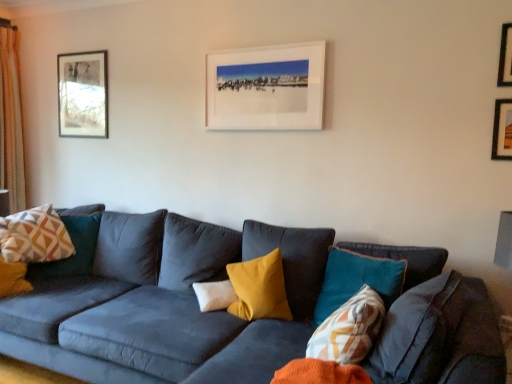
Describe the element at coordinates (502, 130) in the screenshot. This screenshot has width=512, height=384. I see `wooden picture frame at upper right, which is the third picture frame from back to front` at that location.

What do you see at coordinates (34, 236) in the screenshot? I see `geometric-patterned fabric pillow at left, the 3th pillow from the right` at bounding box center [34, 236].

Where is `wooden framed picture at upper left, which appears as the fourth picture frame when viewed from the front`? Image resolution: width=512 pixels, height=384 pixels. wooden framed picture at upper left, which appears as the fourth picture frame when viewed from the front is located at coordinates (83, 94).

Measure the distance between point (216,129) and camera.

They are 2.79 meters apart.

The height and width of the screenshot is (384, 512). In order to click on wooden picture frame at upper right, which ranks as the second picture frame in right-to-left order in this screenshot , I will do `click(502, 130)`.

Considering their positions, is metallic gold picture frame at upper right, which appears as the first picture frame when viewed from the right, located in front of or behind geometric-patterned fabric pillow at left, the third pillow from the front?

Visually, metallic gold picture frame at upper right, which appears as the first picture frame when viewed from the right, is located in front of geometric-patterned fabric pillow at left, the third pillow from the front.

From a real-world perspective, which object stands above the other?

From a 3D spatial view, metallic gold picture frame at upper right, the fourth picture frame when ordered from left to right, is above.

Who is taller, metallic gold picture frame at upper right, the fourth picture frame when ordered from left to right, or geometric-patterned fabric pillow at left, the 3th pillow from the right?

geometric-patterned fabric pillow at left, the 3th pillow from the right, is taller.

Which pillow is the 2nd one when counting from the back of the metallic gold picture frame at upper right, the first picture frame viewed from the front? Please provide its 2D coordinates.

[(34, 236)]

Is metallic gold picture frame at upper right, the fourth picture frame when ordered from left to right, oriented away from wooden picture frame at upper right, arranged as the third picture frame when viewed from the left?

No, wooden picture frame at upper right, arranged as the third picture frame when viewed from the left, is not at the back of metallic gold picture frame at upper right, the fourth picture frame when ordered from left to right.

From a real-world perspective, is metallic gold picture frame at upper right, which is the fourth picture frame from back to front, above or below wooden picture frame at upper right, arranged as the third picture frame when viewed from the left?

In terms of real-world spatial position, metallic gold picture frame at upper right, which is the fourth picture frame from back to front, is above wooden picture frame at upper right, arranged as the third picture frame when viewed from the left.

Is metallic gold picture frame at upper right, which appears as the first picture frame when viewed from the right, in front of or behind wooden picture frame at upper right, which is the third picture frame from back to front, in the image?

metallic gold picture frame at upper right, which appears as the first picture frame when viewed from the right, is in front of wooden picture frame at upper right, which is the third picture frame from back to front.

Considering the relative sizes of white soft pillow at center, the 2th pillow positioned from the back, and geometric-patterned fabric pillow at left, the first pillow viewed from the back, in the image provided, is white soft pillow at center, the 2th pillow positioned from the back, bigger than geometric-patterned fabric pillow at left, the first pillow viewed from the back,?

No.

Between white soft pillow at center, the 2th pillow positioned from the back, and geometric-patterned fabric pillow at left, placed as the 1th pillow when sorted from left to right, which one is positioned behind?

geometric-patterned fabric pillow at left, placed as the 1th pillow when sorted from left to right, is behind.

What's the angular difference between white soft pillow at center, acting as the second pillow starting from the left, and geometric-patterned fabric pillow at left, the first pillow viewed from the back,'s facing directions?

27.3 degrees.

Locate an element on the screen. the 2nd pillow above the white soft pillow at center, acting as the second pillow starting from the left (from the image's perspective) is located at coordinates (34, 236).

Which object is wider, patterned fabric pillow at center, placed as the 3th pillow when sorted from left to right, or wooden picture frame at upper right, arranged as the third picture frame when viewed from the left?

With larger width is patterned fabric pillow at center, placed as the 3th pillow when sorted from left to right.

From the picture: Is patterned fabric pillow at center, the 3th pillow in the back-to-front sequence, closer to camera compared to wooden picture frame at upper right, arranged as the third picture frame when viewed from the left?

Yes, patterned fabric pillow at center, the 3th pillow in the back-to-front sequence, is in front of wooden picture frame at upper right, arranged as the third picture frame when viewed from the left.

Identify the location of the 1st picture frame to the right when counting from the patterned fabric pillow at center, which ranks as the 1th pillow in right-to-left order. (502, 130).

Is patterned fabric pillow at center, which ranks as the first pillow in front-to-back order, located outside wooden picture frame at upper right, which ranks as the 2th picture frame in front-to-back order?

Yes, patterned fabric pillow at center, which ranks as the first pillow in front-to-back order, is not within wooden picture frame at upper right, which ranks as the 2th picture frame in front-to-back order.

Considering the sizes of objects geometric-patterned fabric pillow at left, the 3th pillow from the right, and metallic gold picture frame at upper right, the first picture frame viewed from the front, in the image provided, who is shorter, geometric-patterned fabric pillow at left, the 3th pillow from the right, or metallic gold picture frame at upper right, the first picture frame viewed from the front,?

Standing shorter between the two is metallic gold picture frame at upper right, the first picture frame viewed from the front.

Is geometric-patterned fabric pillow at left, the first pillow viewed from the back, far from metallic gold picture frame at upper right, which is the fourth picture frame from back to front?

geometric-patterned fabric pillow at left, the first pillow viewed from the back, is positioned a significant distance from metallic gold picture frame at upper right, which is the fourth picture frame from back to front.

From the metallic gold picture frame at upper right, which appears as the first picture frame when viewed from the right, count 2nd pillows backward and point to it. Please provide its 2D coordinates.

[(34, 236)]

Which is nearer, (63, 232) or (499, 84)?

Point (63, 232).

Considering the positions of objects geometric-patterned fabric pillow at left, the first pillow viewed from the back, and white matte picture frame at upper center, which ranks as the 2th picture frame in left-to-right order, in the image provided, who is behind, geometric-patterned fabric pillow at left, the first pillow viewed from the back, or white matte picture frame at upper center, which ranks as the 2th picture frame in left-to-right order,?

Positioned behind is geometric-patterned fabric pillow at left, the first pillow viewed from the back.

Is geometric-patterned fabric pillow at left, placed as the 1th pillow when sorted from left to right, taller or shorter than white matte picture frame at upper center, which ranks as the third picture frame in right-to-left order?

Clearly, geometric-patterned fabric pillow at left, placed as the 1th pillow when sorted from left to right, is shorter compared to white matte picture frame at upper center, which ranks as the third picture frame in right-to-left order.

Is white soft pillow at center, arranged as the second pillow when viewed from the right, in contact with wooden picture frame at upper right, which ranks as the 2th picture frame in front-to-back order?

No, white soft pillow at center, arranged as the second pillow when viewed from the right, is not beside wooden picture frame at upper right, which ranks as the 2th picture frame in front-to-back order.

Which is in front, point (236, 298) or point (496, 104)?

Point (496, 104)

From the image's perspective, is white soft pillow at center, the 2th pillow positioned from the back, over wooden picture frame at upper right, which ranks as the second picture frame in right-to-left order?

No, from the image's perspective, white soft pillow at center, the 2th pillow positioned from the back, is not above wooden picture frame at upper right, which ranks as the second picture frame in right-to-left order.

From a real-world perspective, which picture frame is the 4th one above the geometric-patterned fabric pillow at left, placed as the 1th pillow when sorted from left to right? Please provide its 2D coordinates.

[(505, 57)]

Which picture frame is the 1st one when counting from the back of the metallic gold picture frame at upper right, the fourth picture frame when ordered from left to right? Please provide its 2D coordinates.

[(502, 130)]

Considering their positions, is metallic gold picture frame at upper right, which is the fourth picture frame from back to front, positioned closer to white soft pillow at center, the second pillow when ordered from front to back, than light beige textured curtain at left?

metallic gold picture frame at upper right, which is the fourth picture frame from back to front.

Consider the image. Which object lies further to the anchor point metallic gold picture frame at upper right, which is the fourth picture frame from back to front, wooden picture frame at upper right, arranged as the third picture frame when viewed from the left, or wooden framed picture at upper left, which appears as the first picture frame when viewed from the left?

wooden framed picture at upper left, which appears as the first picture frame when viewed from the left, is positioned further to the anchor metallic gold picture frame at upper right, which is the fourth picture frame from back to front.

Considering their positions, is patterned fabric pillow at center, the 3th pillow in the back-to-front sequence, positioned closer to white soft pillow at center, acting as the second pillow starting from the left, than light beige textured curtain at left?

patterned fabric pillow at center, the 3th pillow in the back-to-front sequence, is closer to white soft pillow at center, acting as the second pillow starting from the left.

From the image, which object appears to be farther from wooden picture frame at upper right, which is the third picture frame from back to front, white matte picture frame at upper center, which is the 3th picture frame from front to back, or geometric-patterned fabric pillow at left, the 3th pillow from the right?

Among the two, geometric-patterned fabric pillow at left, the 3th pillow from the right, is located further to wooden picture frame at upper right, which is the third picture frame from back to front.

Estimate the real-world distances between objects in this image. Which object is further from light beige textured curtain at left, patterned fabric pillow at center, which ranks as the 1th pillow in right-to-left order, or geometric-patterned fabric pillow at left, the third pillow from the front?

patterned fabric pillow at center, which ranks as the 1th pillow in right-to-left order.

From the image, which object appears to be farther from geometric-patterned fabric pillow at left, the third pillow from the front, light beige textured curtain at left or white soft pillow at center, arranged as the second pillow when viewed from the right?

white soft pillow at center, arranged as the second pillow when viewed from the right, lies further to geometric-patterned fabric pillow at left, the third pillow from the front, than the other object.

From the image, which object appears to be farther from patterned fabric pillow at center, which ranks as the first pillow in front-to-back order, white soft pillow at center, the 2th pillow positioned from the back, or light beige textured curtain at left?

Among the two, light beige textured curtain at left is located further to patterned fabric pillow at center, which ranks as the first pillow in front-to-back order.

When comparing their distances from geometric-patterned fabric pillow at left, placed as the 1th pillow when sorted from left to right, does wooden framed picture at upper left, which appears as the 1th picture frame when viewed from the back, or white soft pillow at center, arranged as the second pillow when viewed from the right, seem closer?

wooden framed picture at upper left, which appears as the 1th picture frame when viewed from the back, lies closer to geometric-patterned fabric pillow at left, placed as the 1th pillow when sorted from left to right, than the other object.

Where is `picture frame between wooden framed picture at upper left, the fourth picture frame positioned from the right, and wooden picture frame at upper right, which ranks as the second picture frame in right-to-left order, from left to right`? picture frame between wooden framed picture at upper left, the fourth picture frame positioned from the right, and wooden picture frame at upper right, which ranks as the second picture frame in right-to-left order, from left to right is located at coordinates (266, 88).

You are a GUI agent. You are given a task and a screenshot of the screen. Output one action in this format:
    pyautogui.click(x=<x>, y=<y>)
    Task: Click on the pillow between light beige textured curtain at left and white soft pillow at center, the 2th pillow positioned from the back, from left to right
    
    Given the screenshot: What is the action you would take?
    pyautogui.click(x=34, y=236)

Locate an element on the screen. The height and width of the screenshot is (384, 512). picture frame located between wooden framed picture at upper left, which appears as the first picture frame when viewed from the left, and patterned fabric pillow at center, the 3th pillow in the back-to-front sequence, in the left-right direction is located at coordinates (266, 88).

Identify the location of pillow situated between geometric-patterned fabric pillow at left, the first pillow viewed from the back, and white matte picture frame at upper center, which is the 3th picture frame from front to back, from left to right. (214, 295).